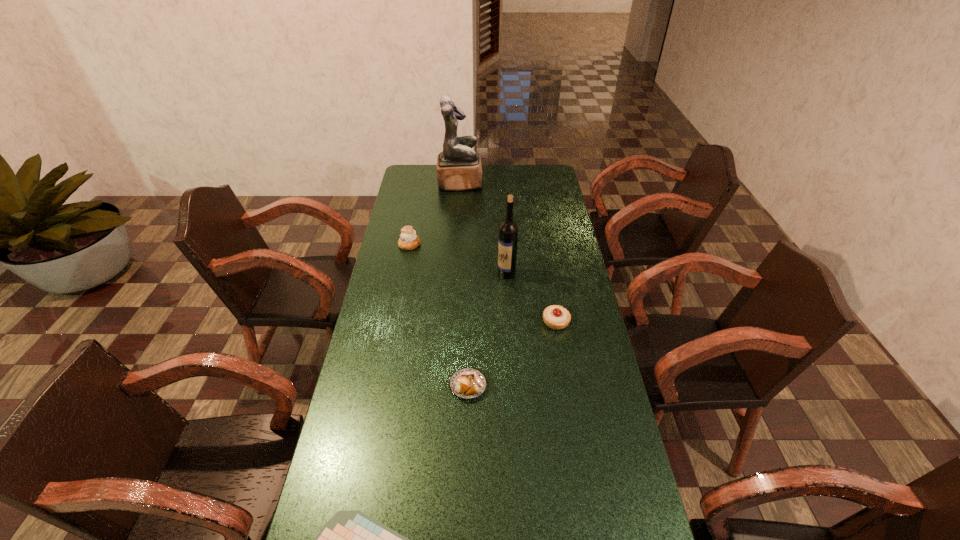
Locate an element on the screen. Image resolution: width=960 pixels, height=540 pixels. free space between the farthest object and the nearest pastry is located at coordinates (464, 284).

Point out which object is positioned as the fifth nearest to the tallest pastry. Please provide its 2D coordinates. Your answer should be formatted as a tuple, i.e. [(x, y)], where the tuple contains the x and y coordinates of a point satisfying the conditions above.

[(351, 539)]

Locate which object is the fifth closest to the nearest object. Please provide its 2D coordinates. Your answer should be formatted as a tuple, i.e. [(x, y)], where the tuple contains the x and y coordinates of a point satisfying the conditions above.

[(459, 167)]

The image size is (960, 540). I want to click on pastry that is the second nearest to the wine bottle, so click(x=409, y=240).

Identify which pastry is located as the third nearest to the fifth shortest object. Please provide its 2D coordinates. Your answer should be formatted as a tuple, i.e. [(x, y)], where the tuple contains the x and y coordinates of a point satisfying the conditions above.

[(468, 383)]

Identify the location of free space that satisfies the following two spatial constraints: 1. on the back side of the second nearest pastry; 2. on the right side of the second pastry from left to right. The image size is (960, 540). (469, 322).

Find the location of a particular element. vacant position in the image that satisfies the following two spatial constraints: 1. on the label of the second nearest pastry; 2. on the left side of the second tallest object is located at coordinates (510, 322).

Locate an element on the screen. The height and width of the screenshot is (540, 960). free point that satisfies the following two spatial constraints: 1. on the label of the fifth object from left to right; 2. on the left side of the second shortest pastry is located at coordinates (510, 322).

Identify the location of free location that satisfies the following two spatial constraints: 1. in a relaxed pose on the fifth farthest object; 2. on the left side of the tallest object. The height and width of the screenshot is (540, 960). (447, 386).